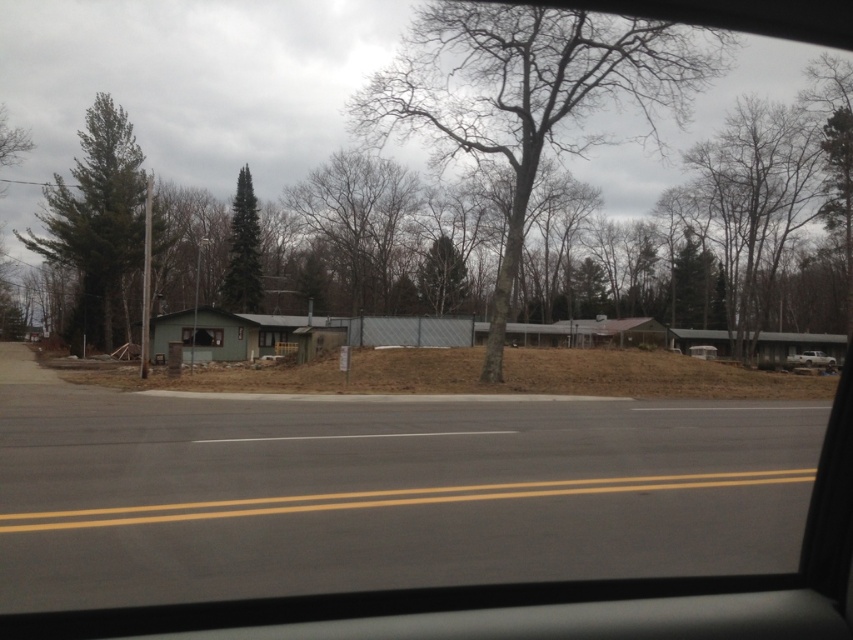
Question: Which of the following is the farthest from the observer?

Choices:
 (A) bare branches at center
 (B) white matte car at center
 (C) white matte truck at right
 (D) green matte tree at upper center

Answer: (D)

Question: Can you confirm if bare wood tree at center is positioned below white matte truck at right?

Choices:
 (A) no
 (B) yes

Answer: (A)

Question: Is bare branches at upper right thinner than white matte car at center?

Choices:
 (A) yes
 (B) no

Answer: (B)

Question: Which object is closer to the camera taking this photo?

Choices:
 (A) white matte car at center
 (B) bare branches at center

Answer: (A)

Question: Which of the following is the closest to the observer?

Choices:
 (A) green textured tree at left
 (B) white matte truck at right

Answer: (B)

Question: Can you confirm if bare wood tree at center is positioned to the left of green textured tree at left?

Choices:
 (A) no
 (B) yes

Answer: (A)